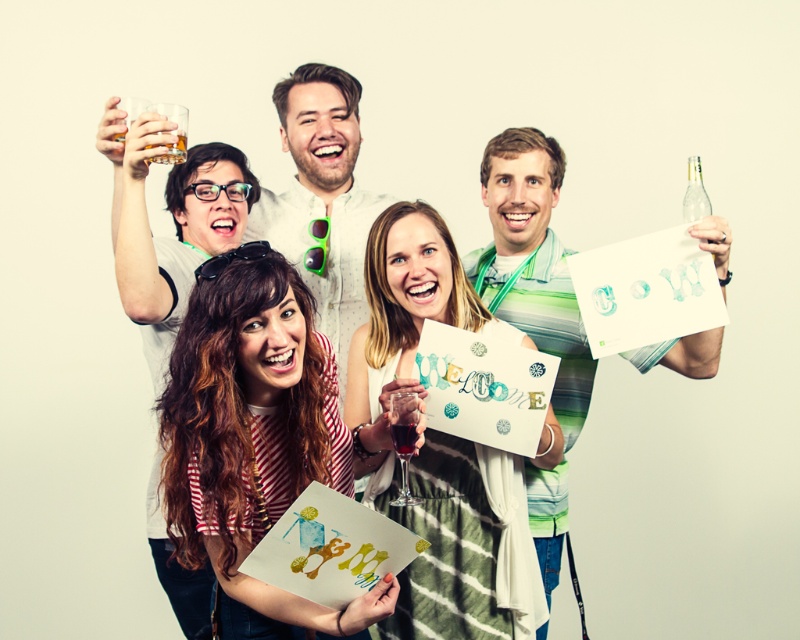
Between matte white shirt at center and translucent glass at upper left, which one appears on the left side from the viewer's perspective?

Positioned to the left is translucent glass at upper left.

Is matte white shirt at center wider than translucent glass at upper left?

Correct, the width of matte white shirt at center exceeds that of translucent glass at upper left.

Is point (364, 305) positioned in front of point (174, 157)?

No, it is not.

I want to click on matte white shirt at center, so click(x=322, y=198).

Is green striped shirt at center behind matte white shirt at center?

No, green striped shirt at center is in front of matte white shirt at center.

Who is more forward, (576, 349) or (356, 97)?

Positioned in front is point (576, 349).

Which is behind, point (468, 259) or point (364, 220)?

Point (364, 220)

The width and height of the screenshot is (800, 640). I want to click on green striped shirt at center, so click(532, 262).

Can you confirm if matte white shirt at center is taller than dark red liquid at center?

Yes.

Which is more to the left, matte white shirt at center or dark red liquid at center?

From the viewer's perspective, matte white shirt at center appears more on the left side.

Does point (296, 109) come behind point (390, 433)?

Yes, point (296, 109) is behind point (390, 433).

I want to click on matte white shirt at center, so click(322, 198).